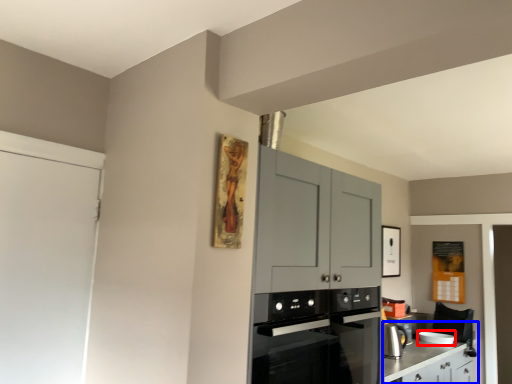
Question: Which object appears closest to the camera in this image, appliance (highlighted by a red box) or counter (highlighted by a blue box)?

Choices:
 (A) appliance
 (B) counter

Answer: (B)